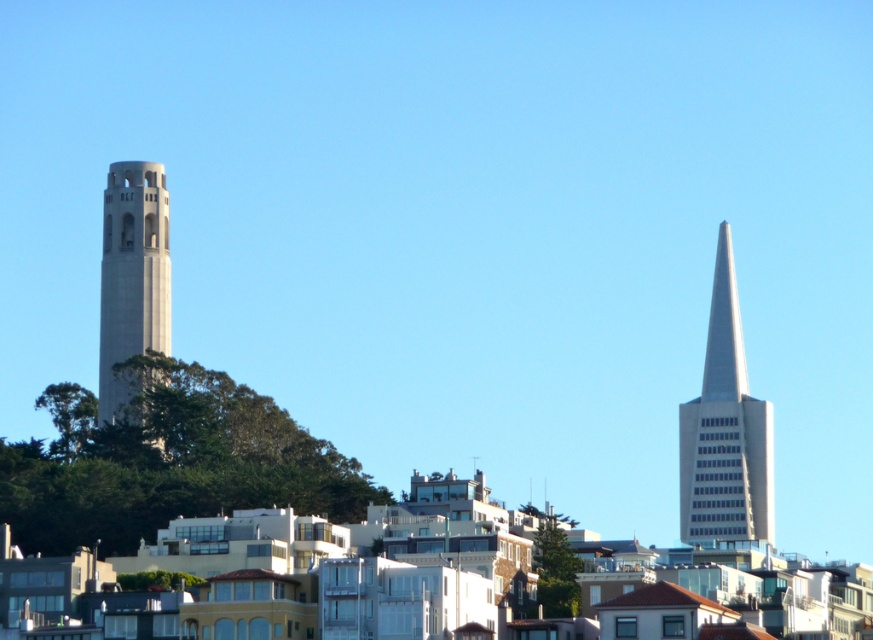
Which is in front, point (741, 385) or point (121, 396)?

Point (121, 396)

The height and width of the screenshot is (640, 873). What are the coordinates of `silver metallic spire at right` in the screenshot? It's located at (725, 429).